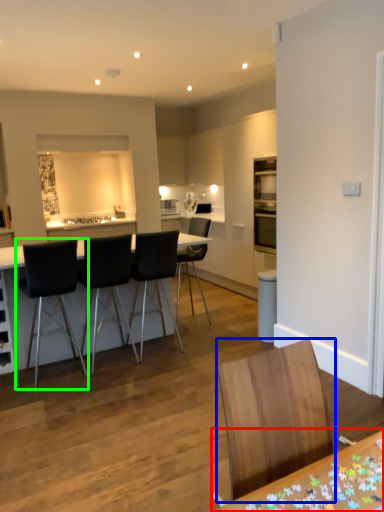
Question: Which is nearer to the table (highlighted by a red box)? chair (highlighted by a blue box) or chair (highlighted by a green box).

Choices:
 (A) chair
 (B) chair

Answer: (A)